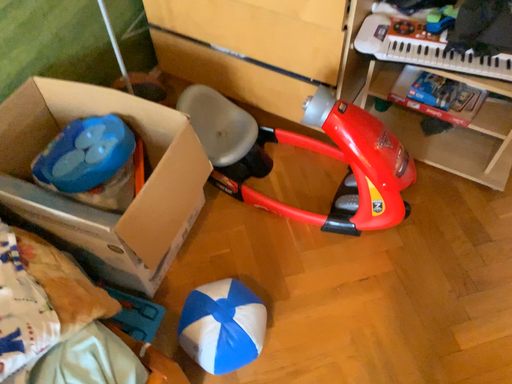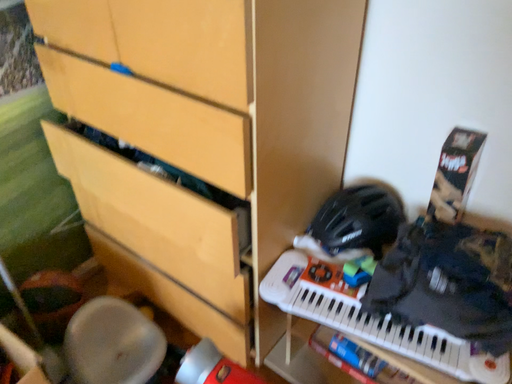
Question: How did the camera likely rotate when shooting the video?

Choices:
 (A) rotated downward
 (B) rotated upward

Answer: (B)